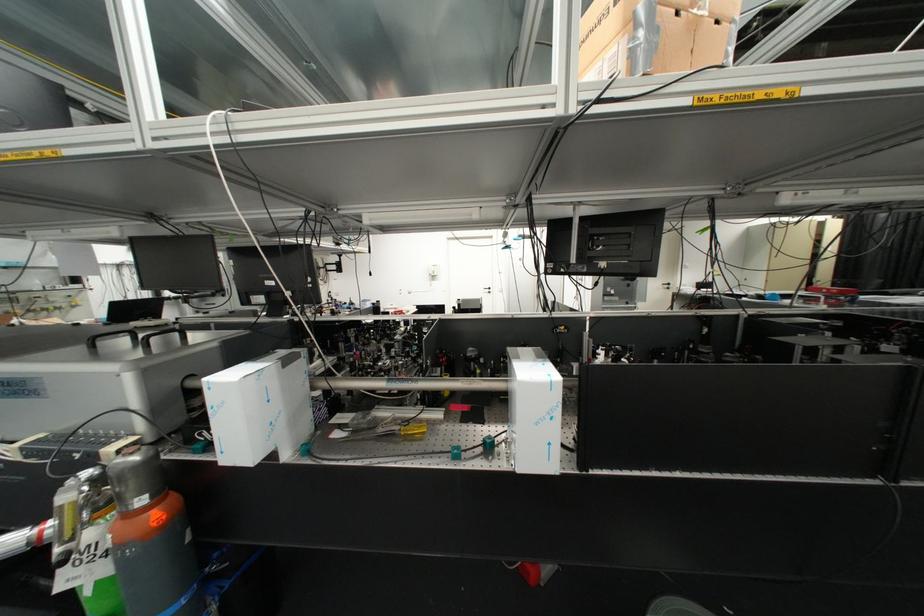
The location [654,36] corresponds to which object?

This point indicates the brown cardboard box.